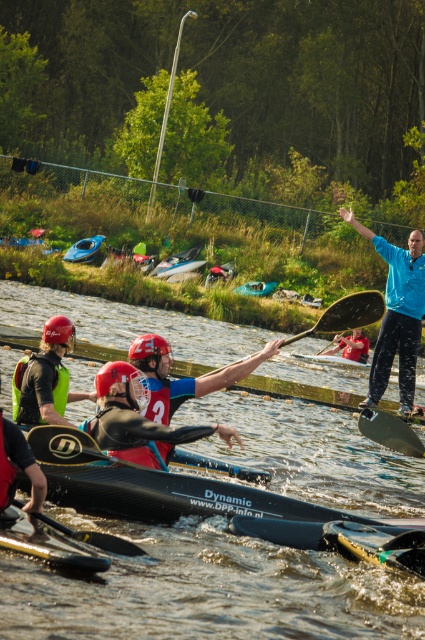
Is the position of matte black life vest at lower left more distant than that of black smooth paddle at center?

No, it is not.

Is matte black life vest at lower left above black smooth paddle at center?

Yes.

At what (x,y) coordinates should I click in order to perform the action: click on matte black life vest at lower left. Please return your answer as a coordinate pair (x, y). Looking at the image, I should click on (17, 467).

The image size is (425, 640). Identify the location of matte black life vest at lower left. (17, 467).

Looking at this image, does blue matte jacket at upper right appear over black matte paddle at center?

Indeed, blue matte jacket at upper right is positioned over black matte paddle at center.

Who is shorter, blue matte jacket at upper right or black matte paddle at center?

Standing shorter between the two is black matte paddle at center.

The height and width of the screenshot is (640, 425). In order to click on blue matte jacket at upper right in this screenshot , I will do `click(396, 316)`.

Can you confirm if black matte paddle at center is positioned above matte black kayak at center?

No, black matte paddle at center is not above matte black kayak at center.

Does point (198, 458) lie behind point (337, 348)?

No.

Who is more forward, (x=45, y=460) or (x=337, y=340)?

Point (x=45, y=460) is in front.

Identify the location of black matte paddle at center. (68, 445).